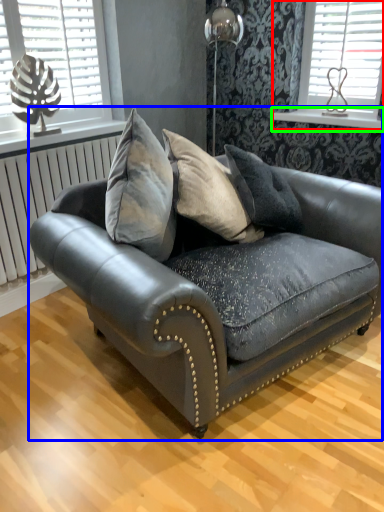
Question: Based on their relative distances, which object is farther from window (highlighted by a red box)? Choose from studio couch (highlighted by a blue box) and window sill (highlighted by a green box).

Choices:
 (A) studio couch
 (B) window sill

Answer: (A)